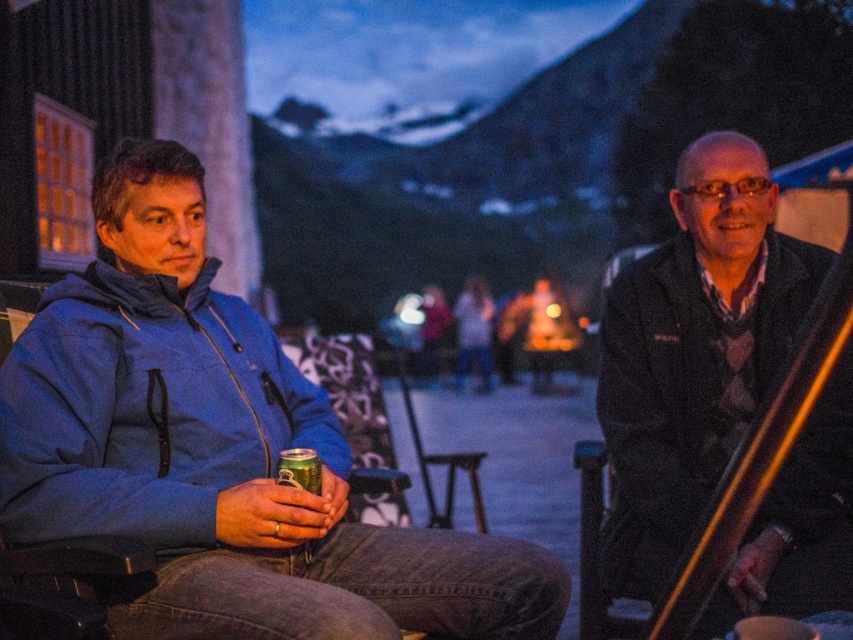
Who is higher up, blue fleece jacket at left or matte white sweater at center?

matte white sweater at center is higher up.

Measure the distance between blue fleece jacket at left and camera.

blue fleece jacket at left and camera are 1.75 meters apart.

Find the location of `blue fleece jacket at left`. blue fleece jacket at left is located at coordinates (219, 451).

Between matte white sweater at center and blurred denim jacket at center, which one appears on the right side from the viewer's perspective?

From the viewer's perspective, blurred denim jacket at center appears more on the right side.

Is point (459, 339) in front of point (428, 298)?

That is True.

Locate an element on the screen. matte white sweater at center is located at coordinates (473, 332).

Can you confirm if matte blue jacket at left is positioned above blurred denim jacket at center?

Actually, matte blue jacket at left is below blurred denim jacket at center.

Who is more forward, (x=235, y=442) or (x=433, y=296)?

Positioned in front is point (x=235, y=442).

At what (x,y) coordinates should I click in order to perform the action: click on matte blue jacket at left. Please return your answer as a coordinate pair (x, y). The height and width of the screenshot is (640, 853). Looking at the image, I should click on (146, 410).